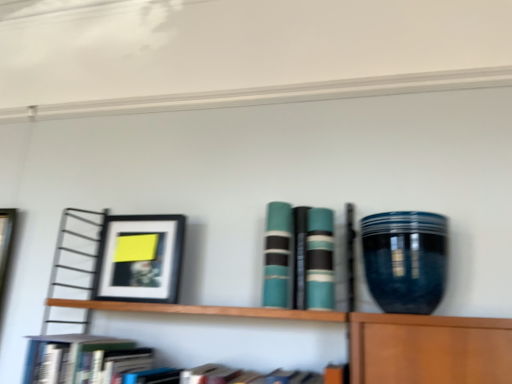
Question: Considering the positions of hardcover book at lower left, the 1th book viewed from the left, and teal matte book at center, the 4th book positioned from the left, in the image, is hardcover book at lower left, the 1th book viewed from the left, wider or thinner than teal matte book at center, the 4th book positioned from the left,?

Choices:
 (A) wide
 (B) thin

Answer: (A)

Question: Is point (84, 352) positioned closer to the camera than point (330, 276)?

Choices:
 (A) farther
 (B) closer

Answer: (B)

Question: Which of these objects is positioned closest to the matte black picture frame at left?

Choices:
 (A) teal matte book at center, the third book from the right
 (B) teal matte book at center, the third book positioned from the left
 (C) hardcover book at lower left, placed as the fourth book when sorted from right to left
 (D) glossy ceramic vase at right
 (E) teal matte book at center, which ranks as the first book in right-to-left order

Answer: (C)

Question: Which object is the farthest from the glossy ceramic vase at right?

Choices:
 (A) hardcover book at lower left, the 1th book viewed from the left
 (B) teal matte book at center, the 4th book positioned from the left
 (C) matte black picture frame at left
 (D) teal matte book at center, the 2th book in the right-to-left sequence
 (E) teal matte book at center, the third book from the right

Answer: (A)